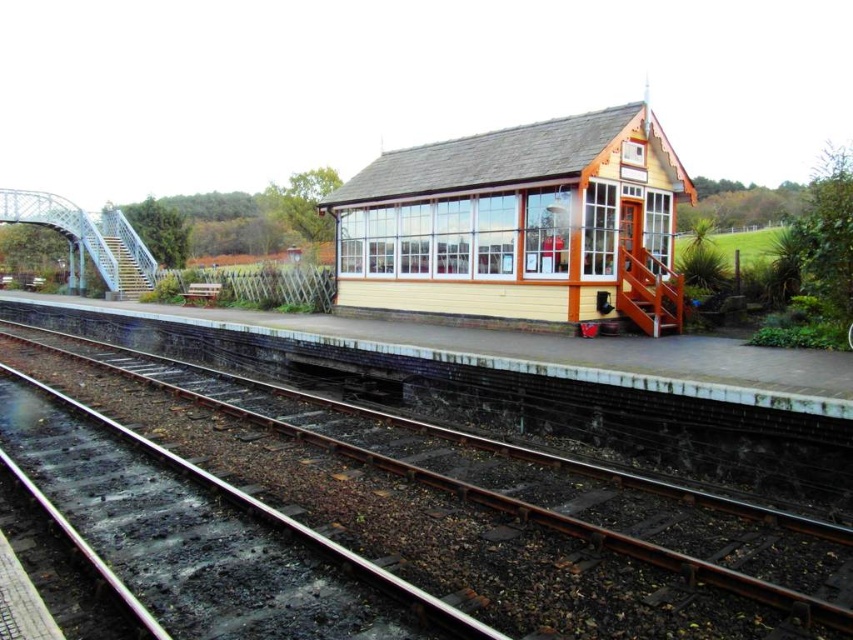
Question: In this image, where is smooth metal tracks at center located relative to yellow wood cabin at center?

Choices:
 (A) below
 (B) above

Answer: (A)

Question: Can you confirm if smooth metal tracks at center is wider than yellow wood cabin at center?

Choices:
 (A) yes
 (B) no

Answer: (A)

Question: Which object appears farthest from the camera in this image?

Choices:
 (A) yellow wood cabin at center
 (B) smooth metal tracks at center

Answer: (A)

Question: Can you confirm if smooth metal tracks at center is positioned to the right of yellow wood cabin at center?

Choices:
 (A) no
 (B) yes

Answer: (A)

Question: Which point is farther to the camera?

Choices:
 (A) smooth metal tracks at center
 (B) yellow wood cabin at center

Answer: (B)